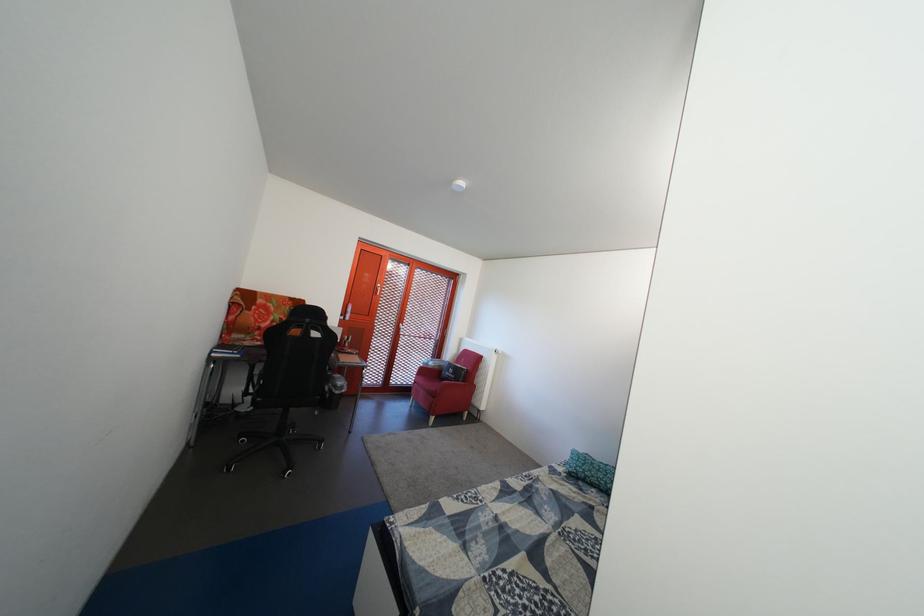
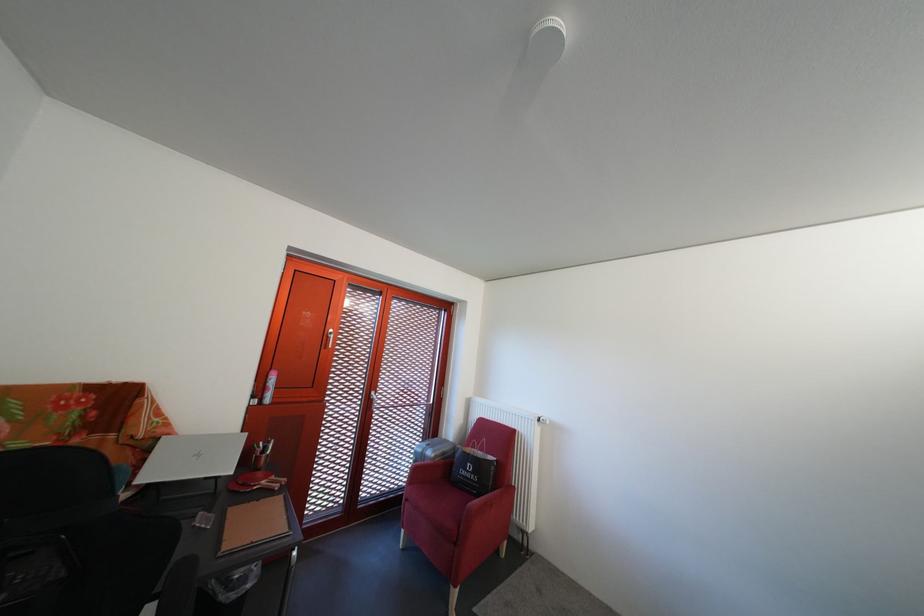
Locate, in the second image, the point that corresponds to [451,373] in the first image.

(455, 460)